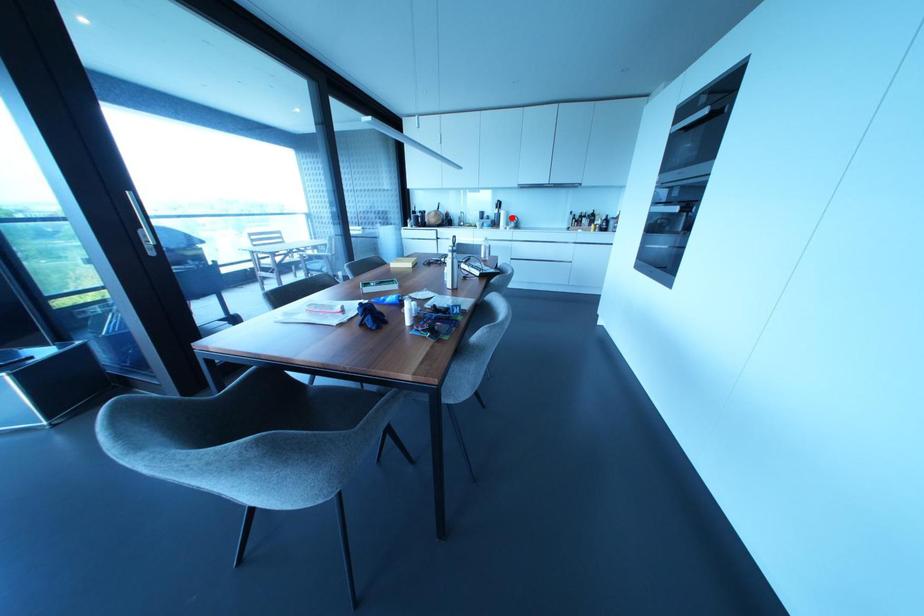
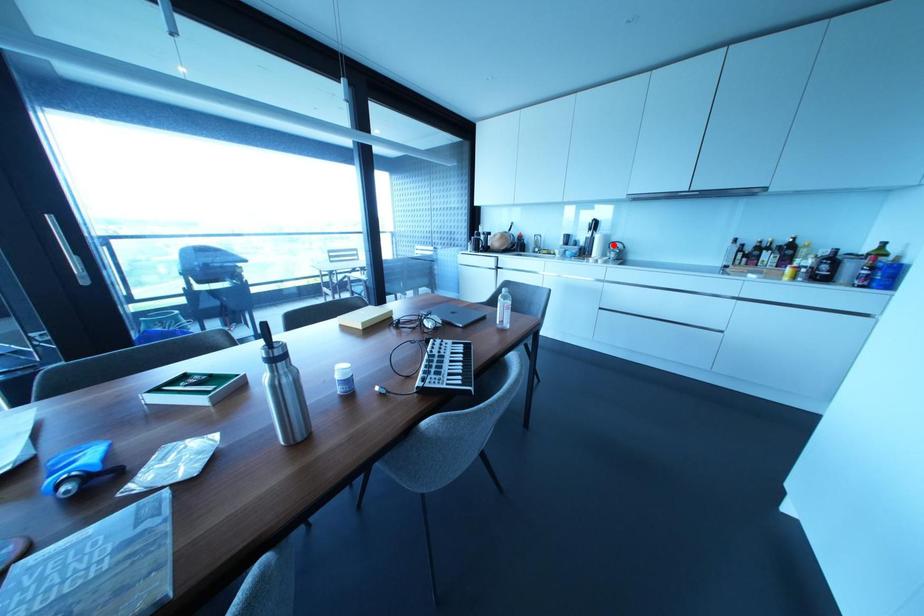
I am providing you with two images of the same scene from different viewpoints. A red point is marked on the first image and another point is marked on the second image. Are the points marked in image1 and image2 representing the same 3D position?

Yes